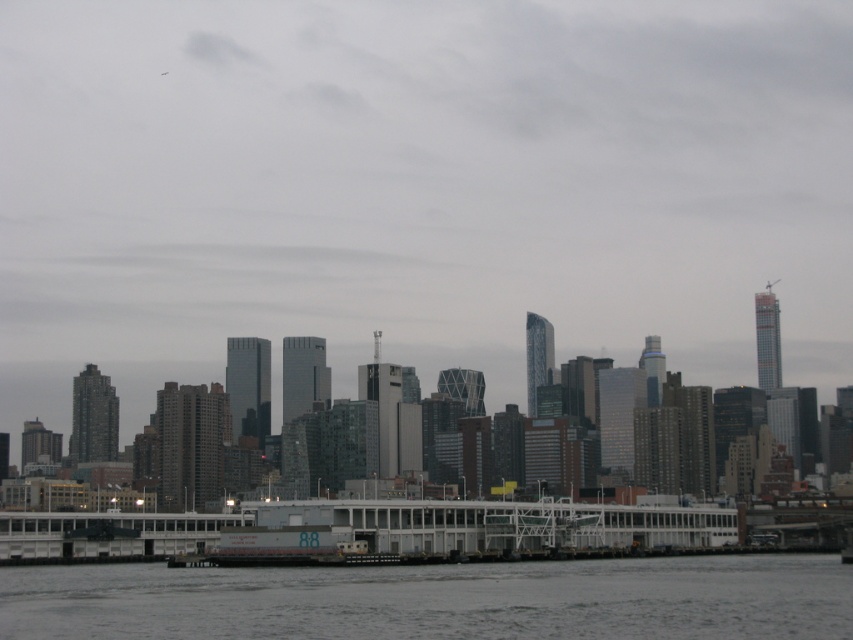
Question: Does gray concrete river at lower center have a lesser width compared to white matte boat at center?

Choices:
 (A) no
 (B) yes

Answer: (A)

Question: Is gray concrete river at lower center thinner than white matte boat at center?

Choices:
 (A) no
 (B) yes

Answer: (A)

Question: Which point is farther to the camera?

Choices:
 (A) white matte boat at center
 (B) gray concrete river at lower center

Answer: (A)

Question: Is gray concrete river at lower center below white matte boat at center?

Choices:
 (A) yes
 (B) no

Answer: (A)